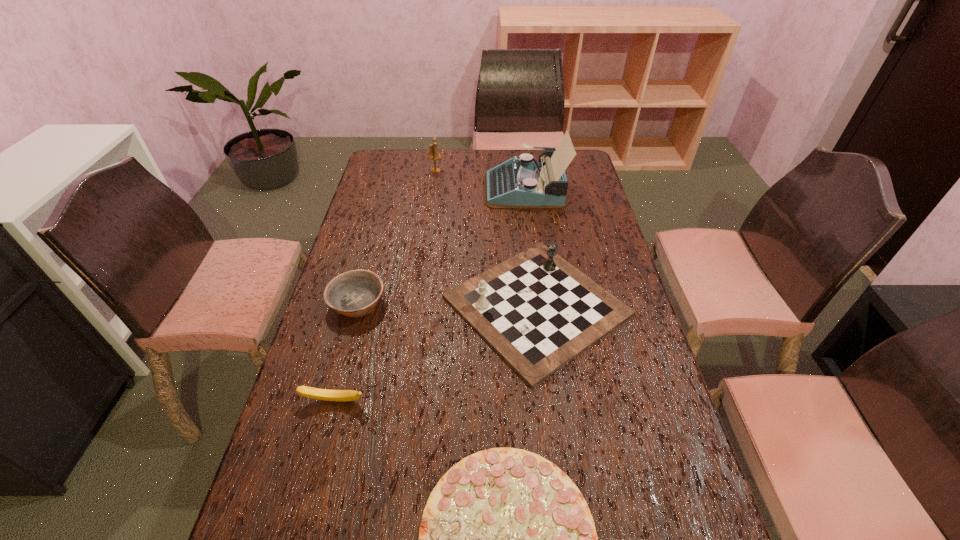
Locate an element on the screen. The width and height of the screenshot is (960, 540). typewriter is located at coordinates (523, 183).

Find the location of `candle holder`. candle holder is located at coordinates (433, 154).

Locate an element on the screen. This screenshot has width=960, height=540. the fourth object from right to left is located at coordinates (433, 154).

The height and width of the screenshot is (540, 960). I want to click on gameboard, so click(x=538, y=312).

The image size is (960, 540). I want to click on the fifth farthest object, so click(315, 393).

Identify the location of bowl. click(x=356, y=293).

The image size is (960, 540). In order to click on blank area located on the typing side of the typewriter in this screenshot , I will do `click(423, 189)`.

Find the location of `free space located 0.060m on the typing side of the typewriter`. free space located 0.060m on the typing side of the typewriter is located at coordinates (468, 189).

Where is `blank space located 0.150m on the typing side of the typewriter`? blank space located 0.150m on the typing side of the typewriter is located at coordinates (446, 189).

You are a GUI agent. You are given a task and a screenshot of the screen. Output one action in this format:
    pyautogui.click(x=<x>, y=<y>)
    Task: Click on the vacant region located on the left of the candle holder
    The image size is (960, 540).
    Given the screenshot: What is the action you would take?
    pyautogui.click(x=416, y=171)